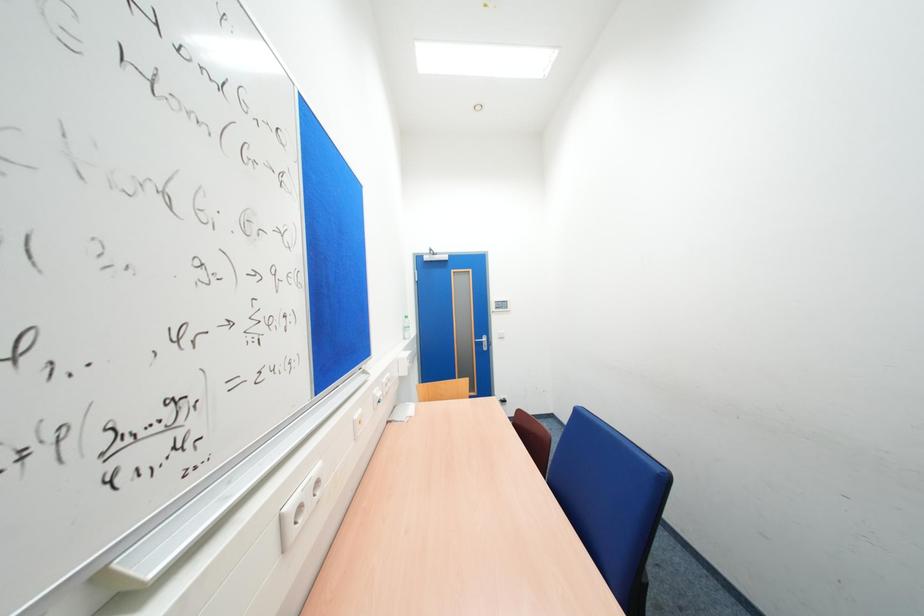
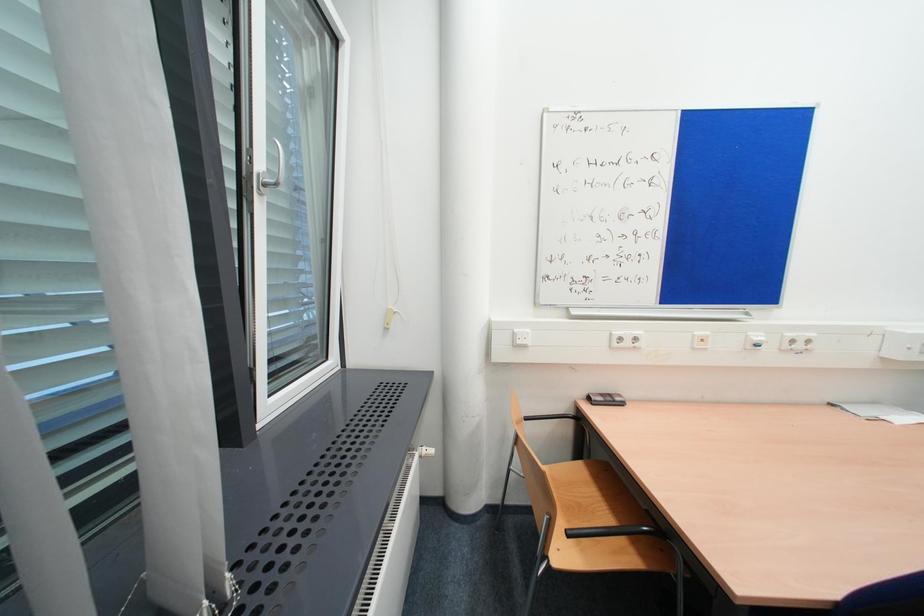
Question: The camera is either moving clockwise (left) or counter-clockwise (right) around the object. The first image is from the beginning of the video and the second image is from the end. Is the camera moving left or right when shooting the video?

Choices:
 (A) Left
 (B) Right

Answer: (B)